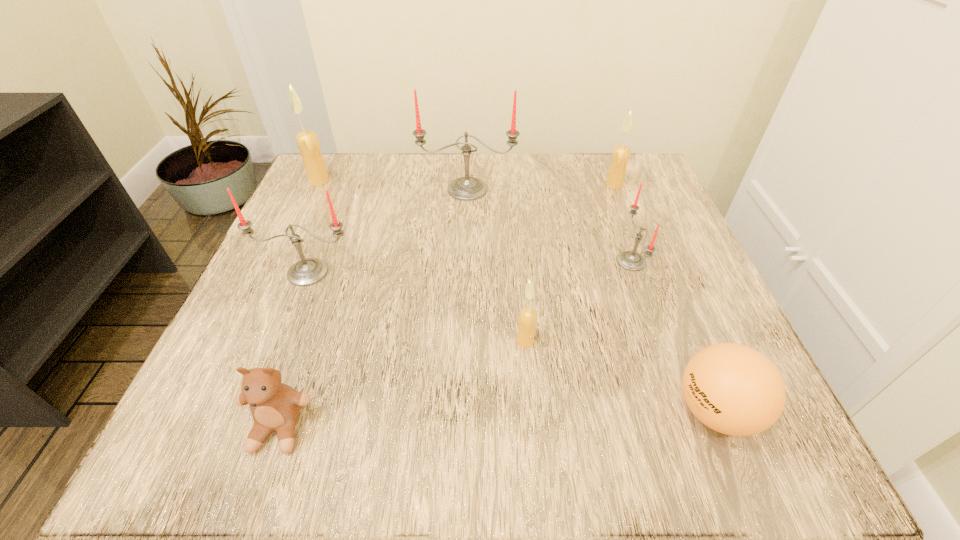
Select which red candle is the second closest to the ping-pong ball. Please provide its 2D coordinates. Your answer should be formatted as a tuple, i.e. [(x, y)], where the tuple contains the x and y coordinates of a point satisfying the conditions above.

[(466, 188)]

Image resolution: width=960 pixels, height=540 pixels. I want to click on the third closest red candle relative to the leftmost cream candle, so click(630, 260).

Locate which cream candle is the closest to the leftmost red candle. Please provide its 2D coordinates. Your answer should be formatted as a tuple, i.e. [(x, y)], where the tuple contains the x and y coordinates of a point satisfying the conditions above.

[(307, 141)]

Image resolution: width=960 pixels, height=540 pixels. In order to click on cream candle identified as the third closest to the teddy bear in this screenshot , I will do `click(621, 153)`.

The height and width of the screenshot is (540, 960). I want to click on free spot that satisfies the following two spatial constraints: 1. on the front side of the second smallest cream candle; 2. on the front-facing side of the smallest red candle, so click(x=643, y=261).

Where is `free space that satisfies the following two spatial constraints: 1. on the front-facing side of the nearest cream candle; 2. on the right side of the second red candle from right to left`? free space that satisfies the following two spatial constraints: 1. on the front-facing side of the nearest cream candle; 2. on the right side of the second red candle from right to left is located at coordinates (462, 341).